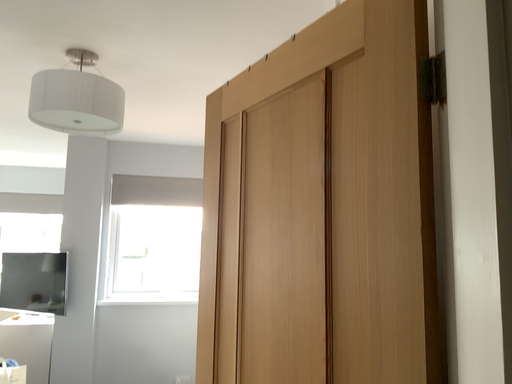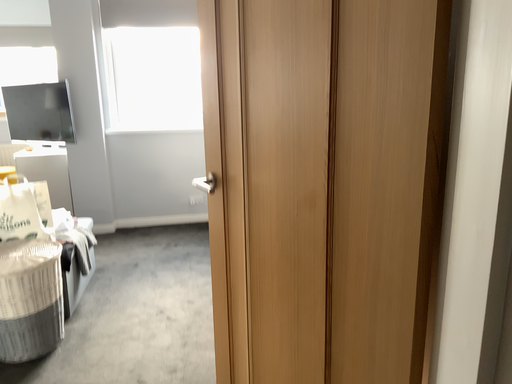
Question: How did the camera likely rotate when shooting the video?

Choices:
 (A) rotated upward
 (B) rotated downward

Answer: (B)